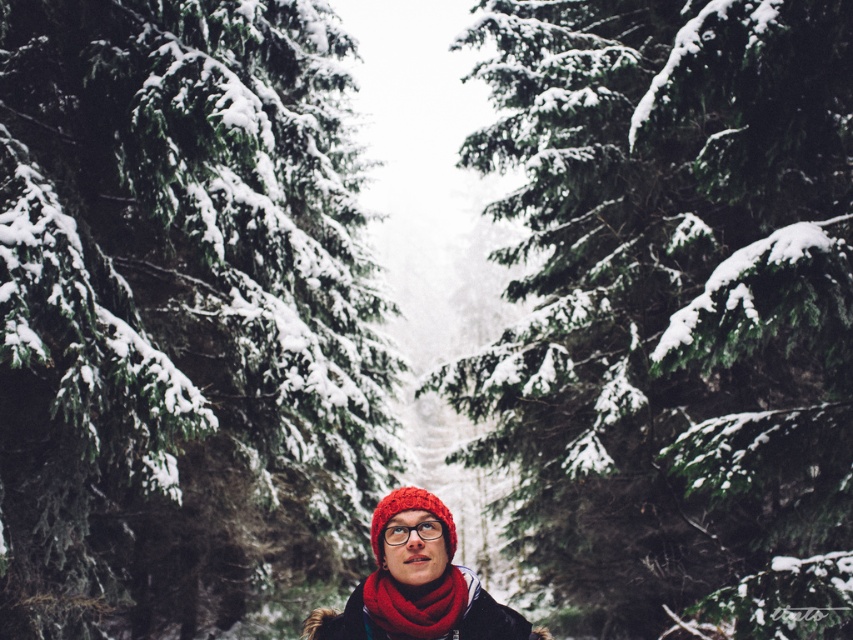
Who is more distant from viewer, [436,602] or [399,538]?

The point [436,602] is more distant.

Is knitted woolen hat at center smaller than transparent plastic goggles at center?

Actually, knitted woolen hat at center might be larger than transparent plastic goggles at center.

Describe the element at coordinates (416, 582) in the screenshot. This screenshot has width=853, height=640. I see `knitted woolen hat at center` at that location.

Locate an element on the screen. The width and height of the screenshot is (853, 640). knitted woolen hat at center is located at coordinates (416, 582).

Is snow-covered evergreen at center further to the viewer compared to transparent plastic goggles at center?

Yes.

Which is above, snow-covered evergreen at center or transparent plastic goggles at center?

snow-covered evergreen at center

Between point (828, 173) and point (393, 534), which one is positioned behind?

Point (828, 173)

Locate an element on the screen. The image size is (853, 640). snow-covered evergreen at center is located at coordinates (674, 308).

Is snow-covered evergreen at center shorter than knitted woolen hat at center?

In fact, snow-covered evergreen at center may be taller than knitted woolen hat at center.

Does snow-covered evergreen at center come in front of knitted woolen hat at center?

No, snow-covered evergreen at center is further to the viewer.

Between point (805, 131) and point (462, 611), which one is positioned in front?

Point (462, 611) is more forward.

Locate an element on the screen. This screenshot has height=640, width=853. snow-covered evergreen at center is located at coordinates (674, 308).